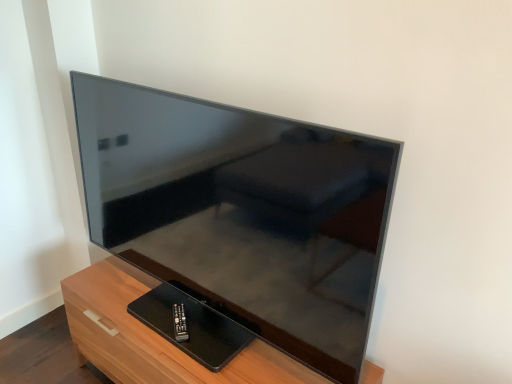
Question: Is black plastic remote at lower center bigger or smaller than matte black tv at center?

Choices:
 (A) small
 (B) big

Answer: (A)

Question: From the image's perspective, is black plastic remote at lower center located above or below matte black tv at center?

Choices:
 (A) below
 (B) above

Answer: (A)

Question: Which is nearer to the wooden tv stand at lower left?

Choices:
 (A) black plastic remote at lower center
 (B) matte black tv at center

Answer: (A)

Question: Which is farther from the wooden tv stand at lower left?

Choices:
 (A) black plastic remote at lower center
 (B) matte black tv at center

Answer: (B)